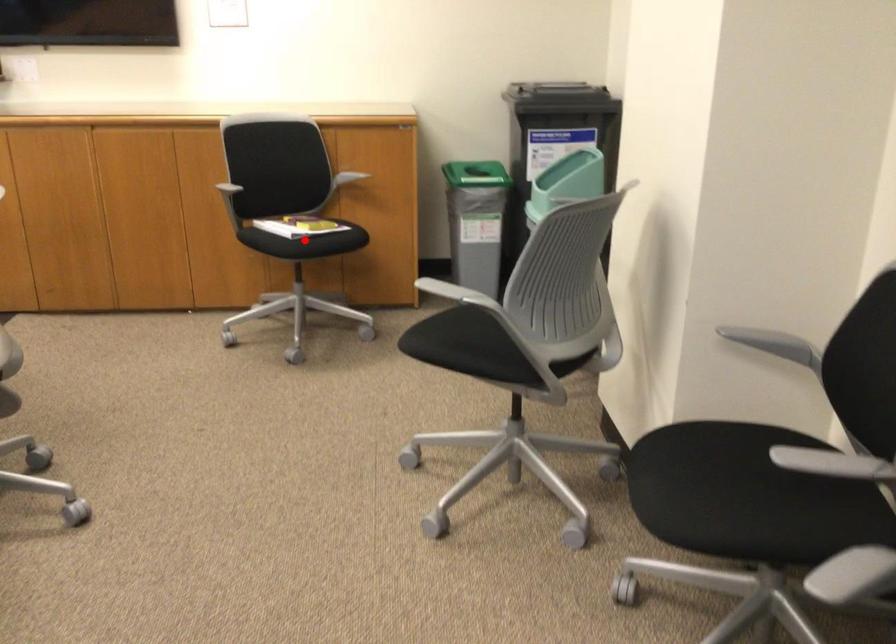
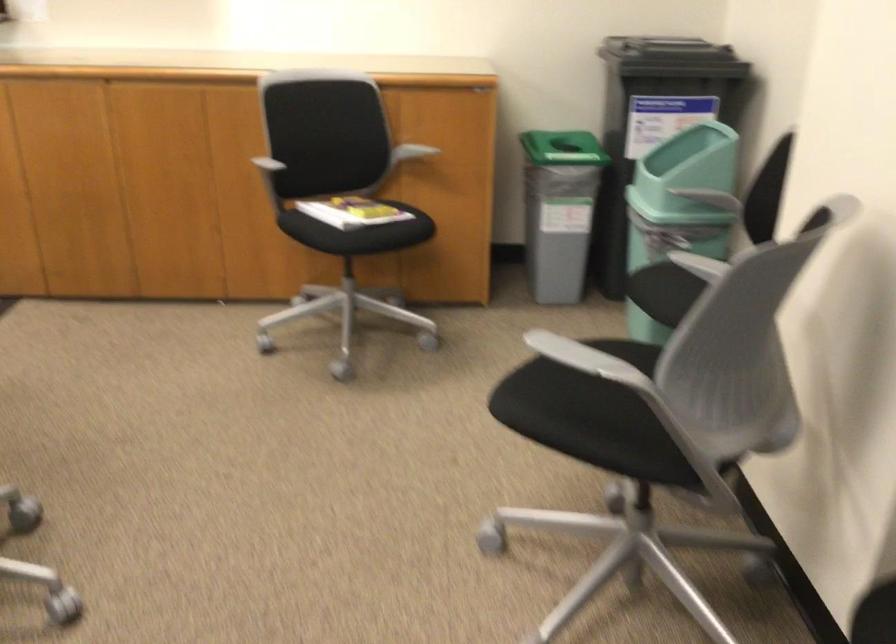
Where in the second image is the point corresponding to the highlighted location from the first image?

(358, 232)